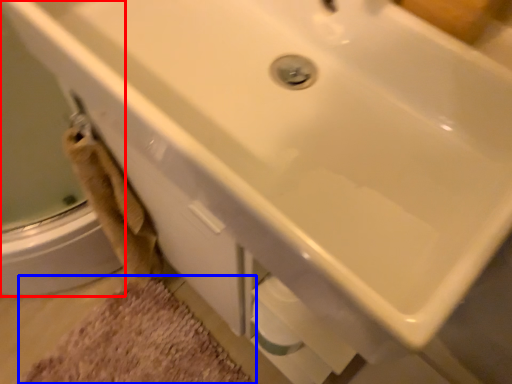
Question: Among these objects, which one is farthest to the camera, shower door (highlighted by a red box) or bath mat (highlighted by a blue box)?

Choices:
 (A) shower door
 (B) bath mat

Answer: (B)